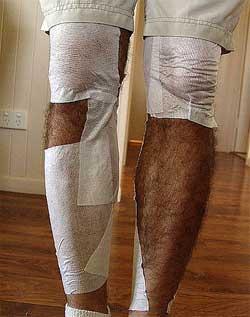
The height and width of the screenshot is (317, 250). Find the location of `wall`. wall is located at coordinates (30, 85), (237, 72).